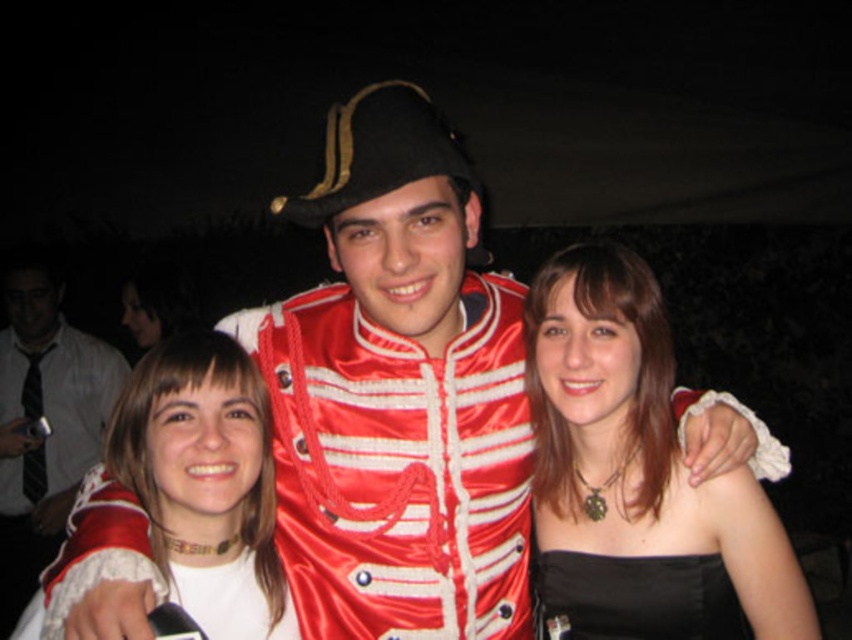
You are standing in front of the group of three people in the night scene. You notice two points marked on the image. The first point is at coordinates point (613, 465) and the second is at point (91, 451). Which of these two points is closer to you?

Point (613, 465) is in front of point (91, 451), so the first point is closer to you.

You are a photographer setting up for a group photo. You have two outfits to choose from for the central figure. The options are the black satin dress at center and the white satin blouse at left. If you want the central figure to appear more dominant in the group photo, which outfit should they wear?

The black satin dress at center has a larger width than the white satin blouse at left, so choosing the black satin dress at center would make the central figure appear more dominant due to its broader silhouette.